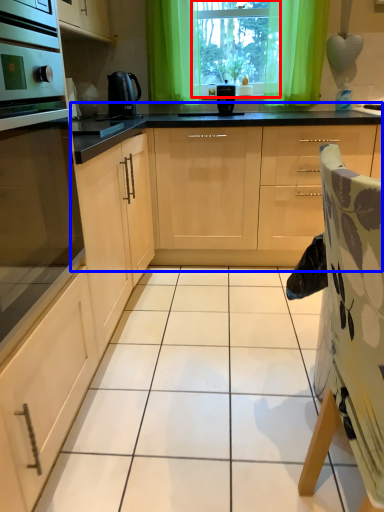
Question: Which object is closer to the camera taking this photo, window screen (highlighted by a red box) or cabinetry (highlighted by a blue box)?

Choices:
 (A) window screen
 (B) cabinetry

Answer: (B)